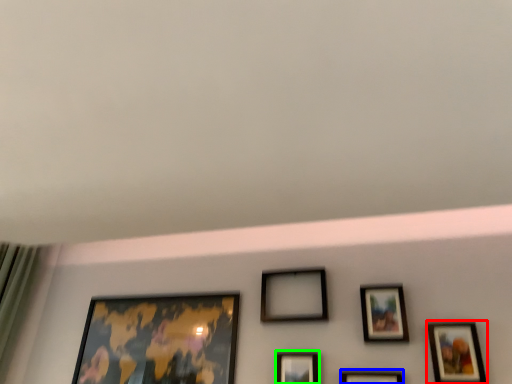
Question: Based on their relative distances, which object is nearer to picture frame (highlighted by a red box)? Choose from picture frame (highlighted by a blue box) and picture frame (highlighted by a green box).

Choices:
 (A) picture frame
 (B) picture frame

Answer: (A)